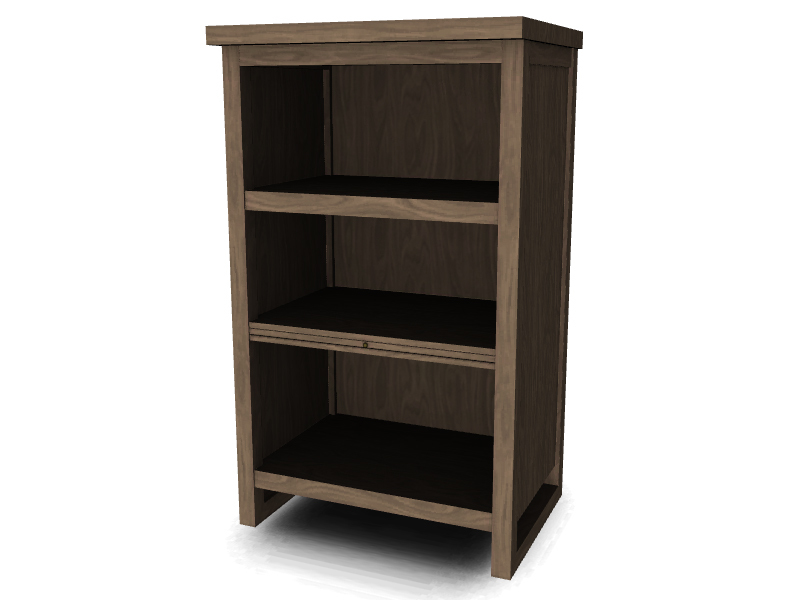
Where is `three lined shelves`? The image size is (800, 600). three lined shelves is located at coordinates (374, 355), (374, 346), (373, 340).